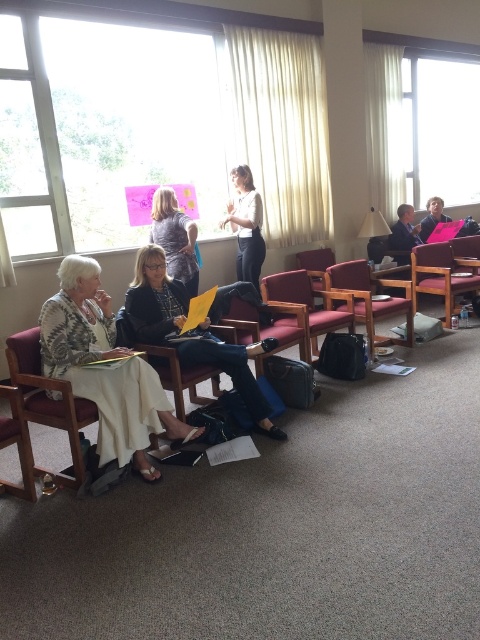
Question: Where is white textured dress at center located in relation to matte black jacket at center in the image?

Choices:
 (A) left
 (B) right

Answer: (A)

Question: Which of the following is the farthest from the observer?

Choices:
 (A) brown leather armchair at center
 (B) white smooth shirt at center
 (C) matte gray shirt at center

Answer: (B)

Question: Estimate the real-world distances between objects in this image. Which object is closer to the leather armchair at center?

Choices:
 (A) matte brown armchair at center
 (B) matte gray shirt at center

Answer: (A)

Question: Observing the image, what is the correct spatial positioning of leather armchair at center in reference to matte brown armchair at center?

Choices:
 (A) above
 (B) below

Answer: (B)

Question: Is velvet-like brown armchair at center positioned behind white smooth shirt at center?

Choices:
 (A) no
 (B) yes

Answer: (A)

Question: Which object is positioned farthest from the wooden armchair at right?

Choices:
 (A) matte black jacket at center
 (B) leather armchair at center
 (C) white smooth shirt at center
 (D) velvet-like brown armchair at center

Answer: (A)